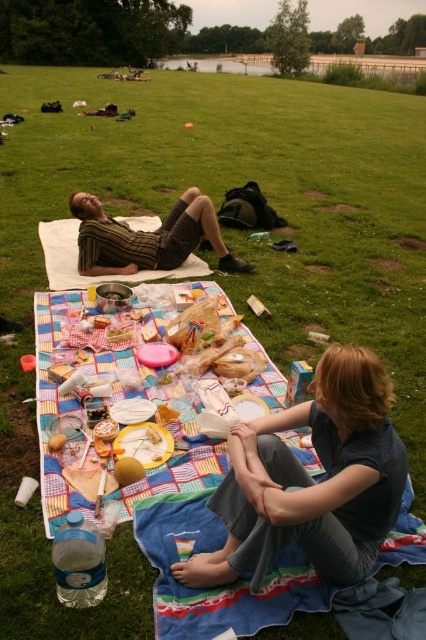
You are organizing a picnic and need to pack up the items. Which item takes up more space when folded, the denim jeans at lower right or the striped fabric shirt at upper left?

The striped fabric shirt at upper left occupies more space than denim jeans at lower right when folded.

You are at a picnic and want to find your items. You see the denim jeans at lower right and the striped fabric shirt at upper left. Which item is located to the right side of the other?

The denim jeans at lower right is to the right of striped fabric shirt at upper left, so the denim jeans at lower right is located to the right side of the striped fabric shirt at upper left.